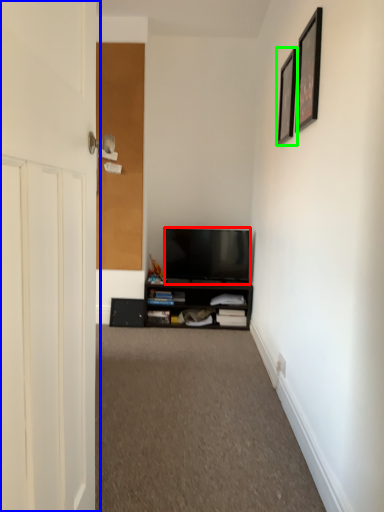
Question: Estimate the real-world distances between objects in this image. Which object is closer to television (highlighted by a red box), door (highlighted by a blue box) or picture frame (highlighted by a green box)?

Choices:
 (A) door
 (B) picture frame

Answer: (B)